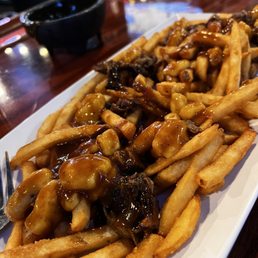
At what (x,y) coordinates should I click in order to perform the action: click on table. Please return your answer as a coordinate pair (x, y). The image size is (258, 258). Looking at the image, I should click on (26, 72).